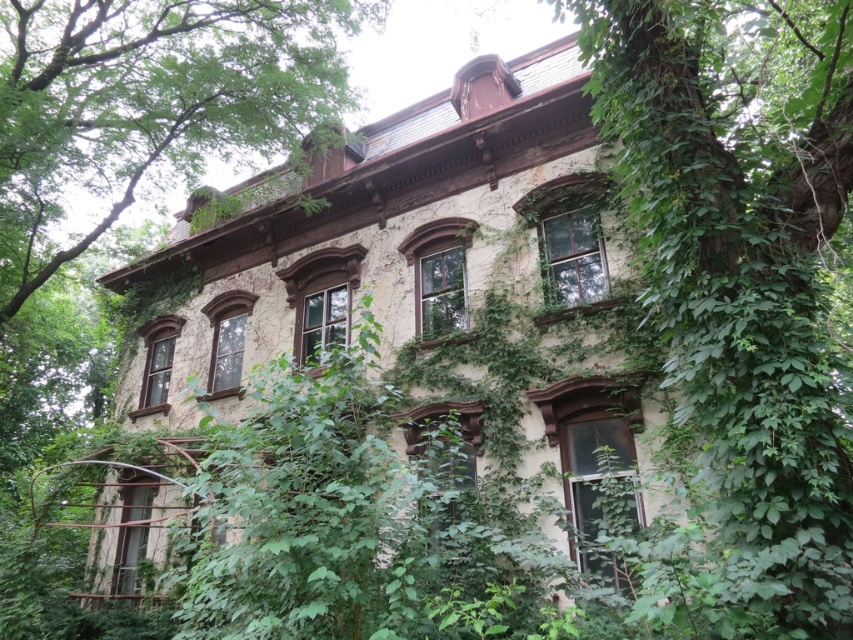
Question: Which point appears farthest from the camera in this image?

Choices:
 (A) (695, 388)
 (B) (27, 84)

Answer: (B)

Question: From the image, what is the correct spatial relationship of green leafy vine at center in relation to green leafy tree at upper center?

Choices:
 (A) below
 (B) above

Answer: (A)

Question: Can you confirm if green leafy vine at center is positioned below green leafy tree at upper center?

Choices:
 (A) yes
 (B) no

Answer: (A)

Question: Which point is closer to the camera taking this photo?

Choices:
 (A) (4, 316)
 (B) (619, 147)

Answer: (B)

Question: Can you confirm if green leafy vine at center is positioned below green leafy tree at upper center?

Choices:
 (A) no
 (B) yes

Answer: (B)

Question: Among these objects, which one is nearest to the camera?

Choices:
 (A) green leafy tree at upper center
 (B) green leafy vine at center

Answer: (B)